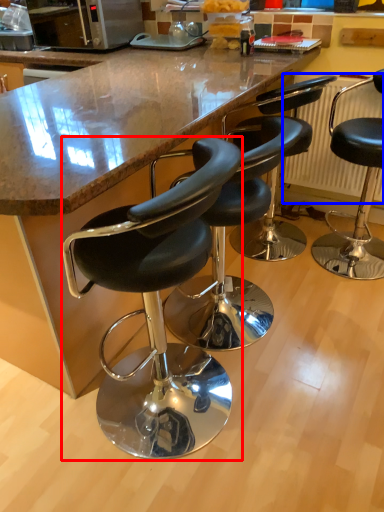
Question: Among these objects, which one is nearest to the camera, chair (highlighted by a red box) or radiator (highlighted by a blue box)?

Choices:
 (A) chair
 (B) radiator

Answer: (A)